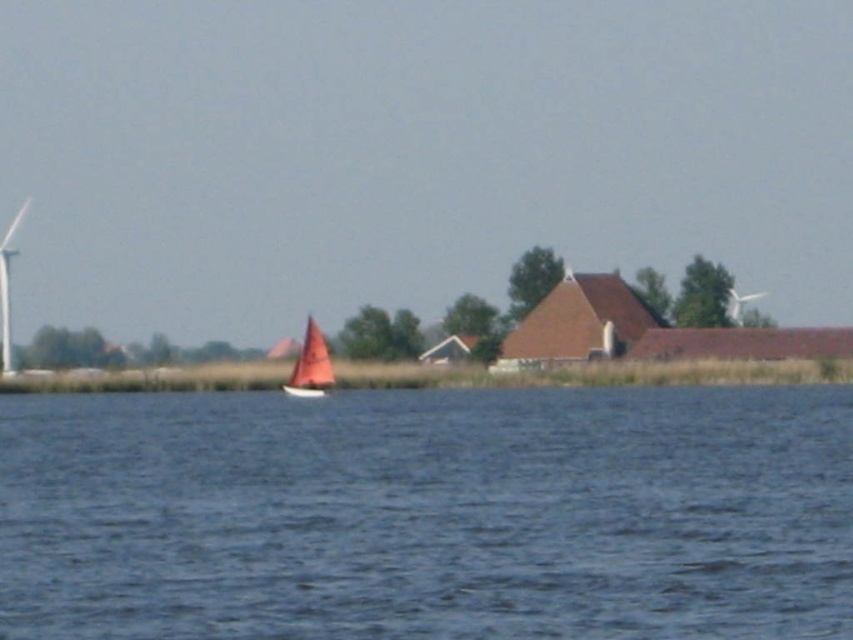
You are standing at the center of the image and want to locate the blue water at center. According to the coordinates provided, in which direction should you look to find it?

The blue water at center is located at coordinates point [428,515], so you should look slightly to the right and directly ahead to find it.

You are standing at the lakeside and want to take a photo of the white plastic wind turbine at left and the blue water at center. Which object should you focus on first to ensure both are in focus?

You should focus on the white plastic wind turbine at left first because it is farther away than the blue water at center, so adjusting focus from far to near will help both be in focus.

You are standing on the lakeside and want to compare the height of the red sailboat at center and the white plastic wind turbine at left. Which one is taller?

The white plastic wind turbine at left is taller than the red sailboat at center.